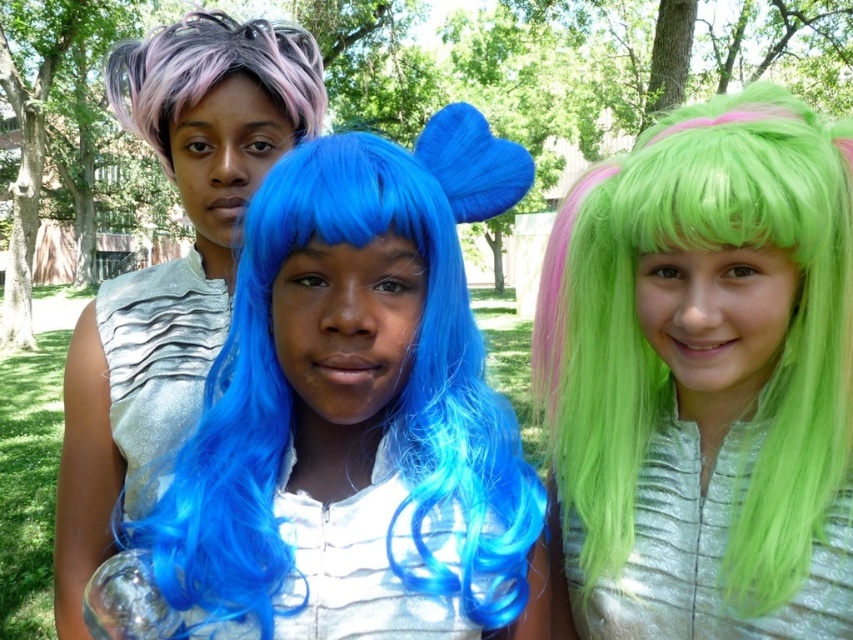
Question: Is neon green wig at center further to camera compared to matte silver dress at center?

Choices:
 (A) no
 (B) yes

Answer: (A)

Question: Where is matte silver dress at center located in relation to pastel purple dreadlocks at upper left in the image?

Choices:
 (A) right
 (B) left

Answer: (A)

Question: Estimate the real-world distances between objects in this image. Which object is farther from the neon green wig at center?

Choices:
 (A) blue silky wig at center
 (B) pastel purple dreadlocks at upper left

Answer: (B)

Question: Estimate the real-world distances between objects in this image. Which object is closer to the neon green wig at center?

Choices:
 (A) blue silky wig at center
 (B) pastel purple dreadlocks at upper left

Answer: (A)

Question: In this image, where is blue silky wig at center located relative to pastel purple dreadlocks at upper left?

Choices:
 (A) above
 (B) below

Answer: (B)

Question: Which of the following is the farthest from the observer?

Choices:
 (A) coord(277,225)
 (B) coord(651,280)

Answer: (B)